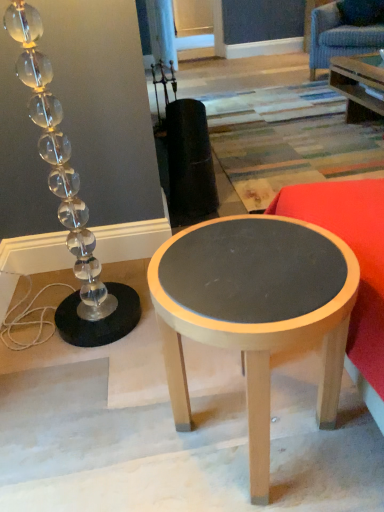
Question: From a real-world perspective, is blue fabric swivel chair at upper right physically located above or below matte gray wood table at center?

Choices:
 (A) below
 (B) above

Answer: (B)

Question: Considering their positions, is blue fabric swivel chair at upper right located in front of or behind matte gray wood table at center?

Choices:
 (A) front
 (B) behind

Answer: (B)

Question: Which object is the farthest from the matte red fabric couch at right?

Choices:
 (A) blue fabric swivel chair at upper right
 (B) matte gray wood table at center
 (C) clear glass lamp at left

Answer: (A)

Question: Which is farther from the blue fabric swivel chair at upper right?

Choices:
 (A) matte gray wood table at center
 (B) clear glass lamp at left
 (C) matte red fabric couch at right

Answer: (A)